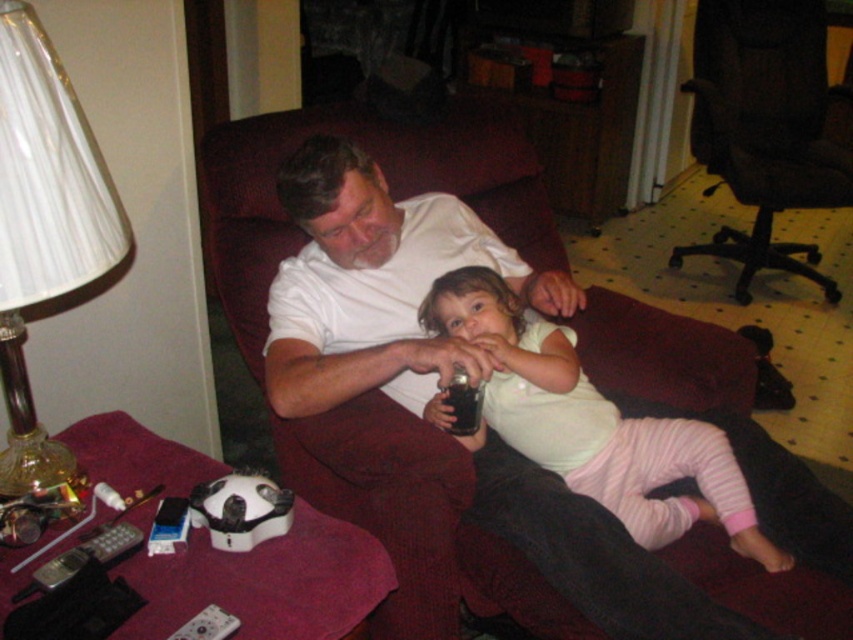
Question: Can you confirm if black fabric office chair at upper right is thinner than white plastic remote at lower left?

Choices:
 (A) yes
 (B) no

Answer: (B)

Question: Can you confirm if white pleated lampshade at left is wider than white plastic remote at lower left?

Choices:
 (A) yes
 (B) no

Answer: (A)

Question: Can you confirm if white pleated lampshade at left is positioned to the right of white plastic remote at lower left?

Choices:
 (A) yes
 (B) no

Answer: (B)

Question: Which point appears farthest from the camera in this image?

Choices:
 (A) (x=244, y=163)
 (B) (x=712, y=429)
 (C) (x=59, y=205)

Answer: (A)

Question: Which object is farther from the camera taking this photo?

Choices:
 (A) maroon fabric couch at center
 (B) white pleated lampshade at left

Answer: (A)

Question: Which object appears closest to the camera in this image?

Choices:
 (A) white matte shirt at center
 (B) black fabric office chair at upper right
 (C) maroon fabric couch at center
 (D) white plastic remote at lower left

Answer: (D)